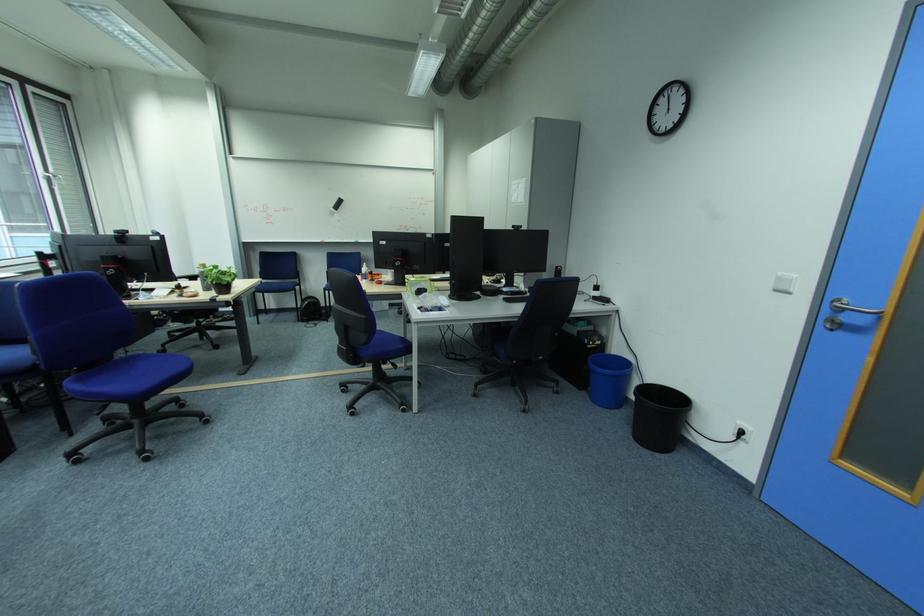
Where is `small plant pot`? The height and width of the screenshot is (616, 924). small plant pot is located at coordinates (222, 288).